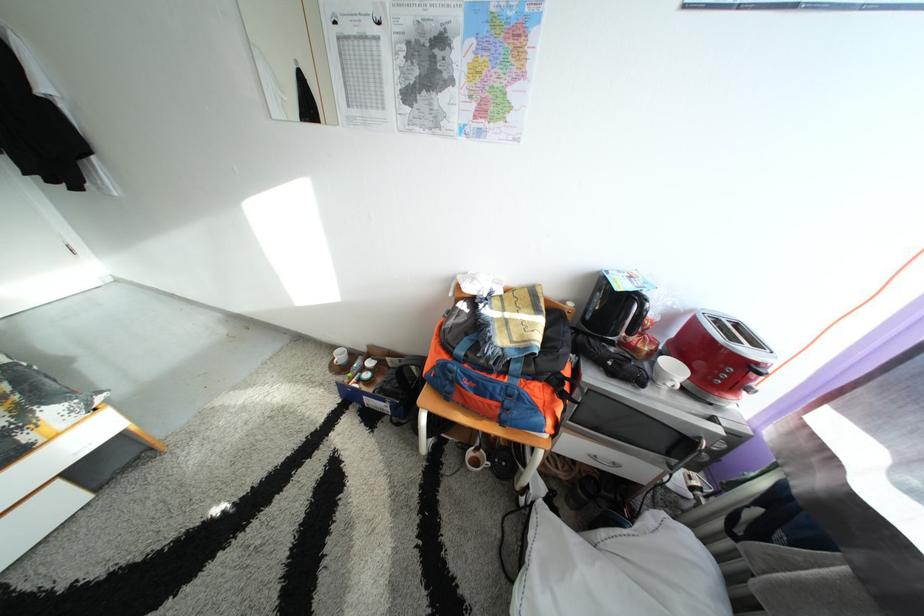
This screenshot has height=616, width=924. In order to click on black kettle handle in this screenshot , I will do `click(637, 313)`.